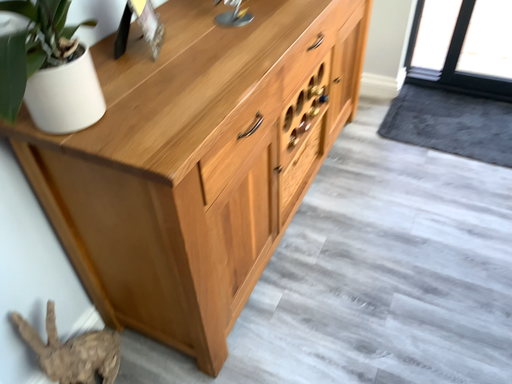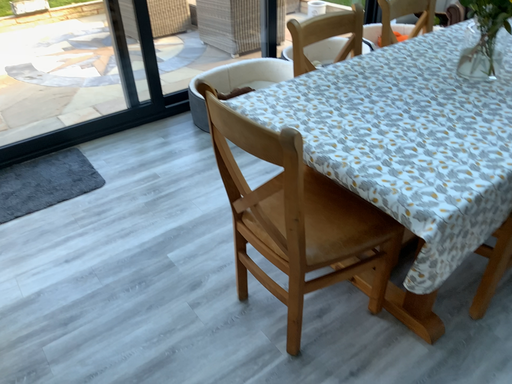
Question: Which way did the camera rotate in the video?

Choices:
 (A) rotated left
 (B) rotated right

Answer: (B)